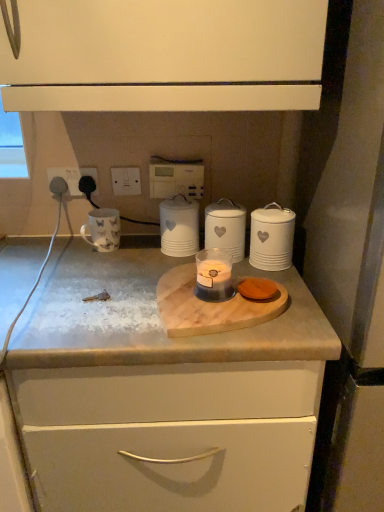
In order to click on free space in front of white glossy mug at left in this screenshot , I will do `click(93, 273)`.